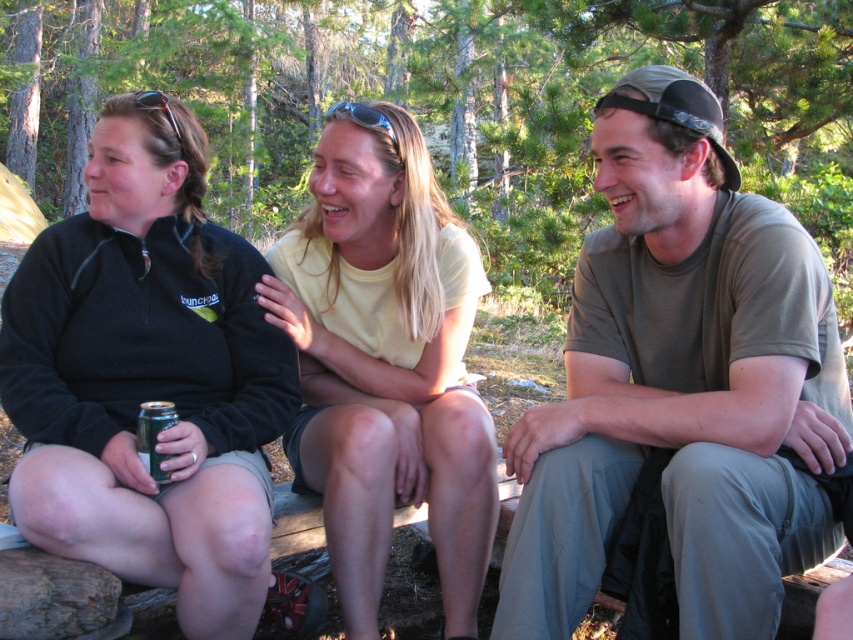
Between matte olive green t-shirt at center and black fleece jacket at left, which one appears on the left side from the viewer's perspective?

Positioned to the left is black fleece jacket at left.

Consider the image. Can you confirm if matte olive green t-shirt at center is thinner than black fleece jacket at left?

In fact, matte olive green t-shirt at center might be wider than black fleece jacket at left.

Find the location of a particular element. Image resolution: width=853 pixels, height=640 pixels. matte olive green t-shirt at center is located at coordinates (682, 381).

Is point (608, 458) more distant than point (380, 228)?

No, (608, 458) is in front of (380, 228).

Can you confirm if matte olive green t-shirt at center is smaller than yellow cotton shirt at center?

Incorrect, matte olive green t-shirt at center is not smaller in size than yellow cotton shirt at center.

Is point (643, 108) positioned before point (466, 497)?

Yes.

The width and height of the screenshot is (853, 640). I want to click on matte olive green t-shirt at center, so click(x=682, y=381).

Does point (3, 346) come behind point (402, 337)?

That is False.

Which of these two, black fleece jacket at left or yellow cotton shirt at center, stands shorter?

With less height is black fleece jacket at left.

The image size is (853, 640). Describe the element at coordinates (148, 376) in the screenshot. I see `black fleece jacket at left` at that location.

Find the location of a particular element. The width and height of the screenshot is (853, 640). black fleece jacket at left is located at coordinates (x=148, y=376).